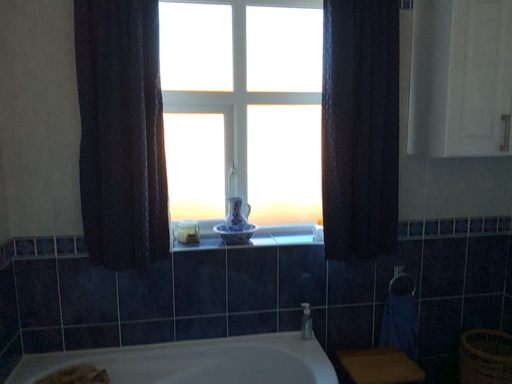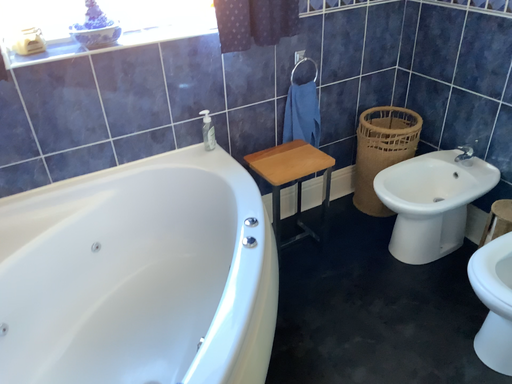
Question: Which way did the camera rotate in the video?

Choices:
 (A) rotated right
 (B) rotated left

Answer: (A)